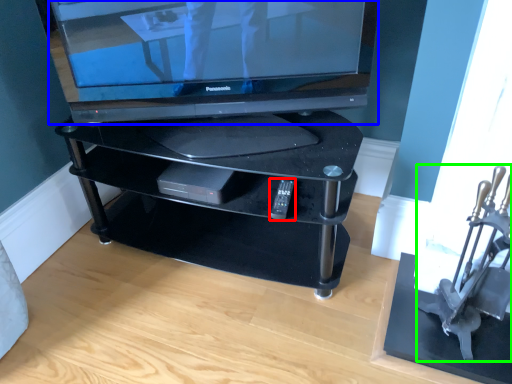
Question: Which object is the farthest from remote (highlighted by a red box)? Choose among these: television (highlighted by a blue box) or armchair (highlighted by a green box).

Choices:
 (A) television
 (B) armchair

Answer: (B)